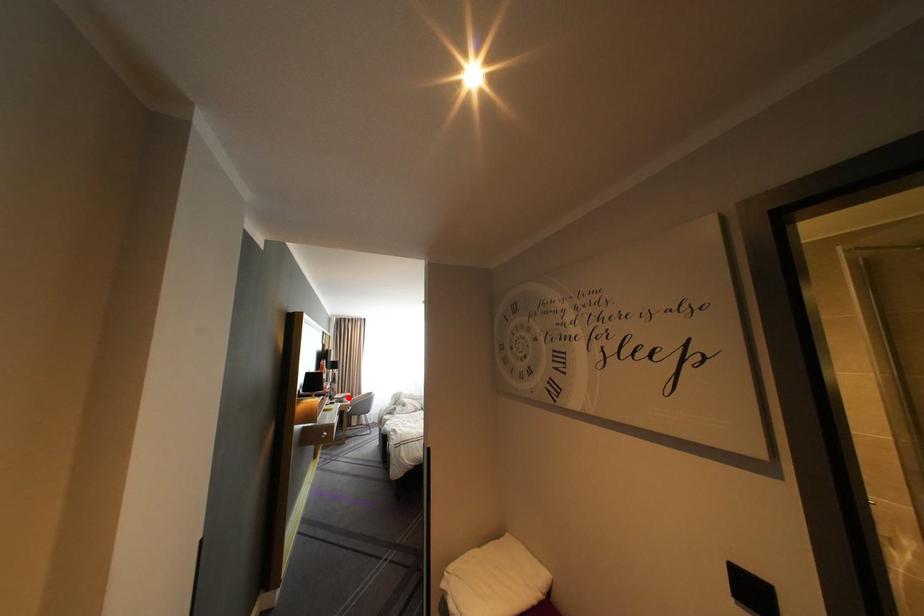
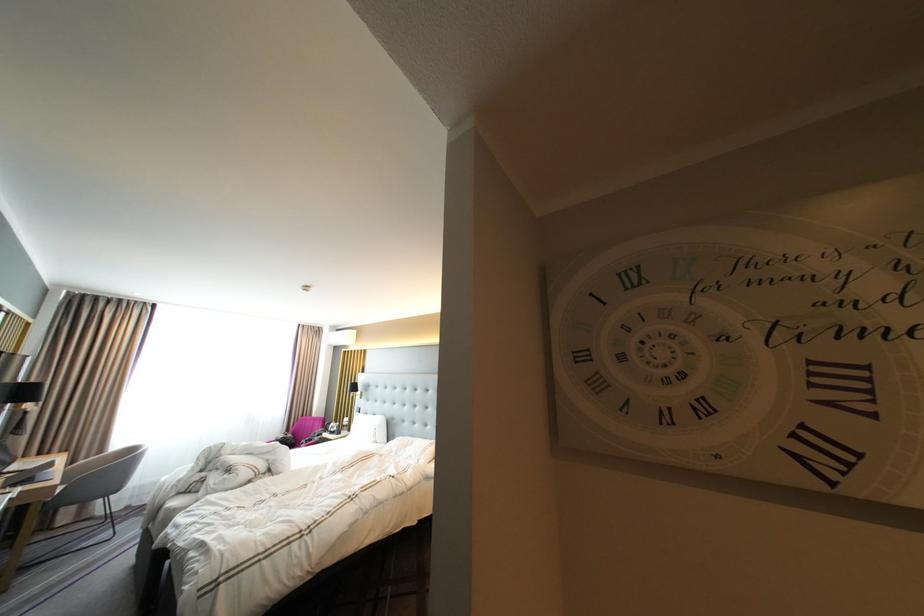
In the second image, find the point that corresponds to the highlighted location in the first image.

(27, 468)